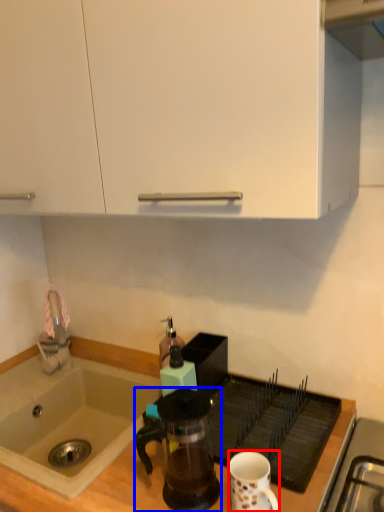
Question: Which object appears farthest to the camera in this image, coffee cup (highlighted by a red box) or coffee maker (highlighted by a blue box)?

Choices:
 (A) coffee cup
 (B) coffee maker

Answer: (B)